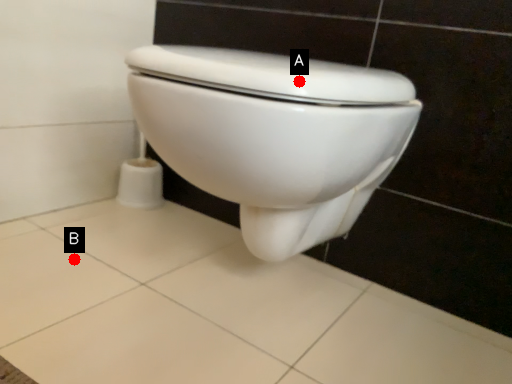
Question: Two points are circled on the image, labeled by A and B beside each circle. Which point appears closest to the camera in this image?

Choices:
 (A) A is closer
 (B) B is closer

Answer: (A)